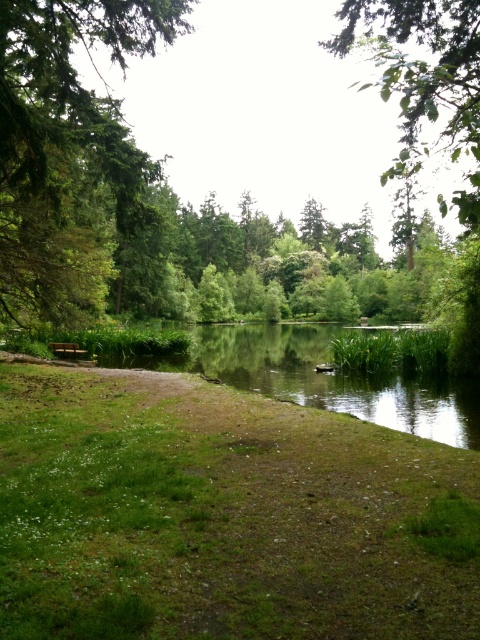
Image resolution: width=480 pixels, height=640 pixels. Identify the location of green leafy tree at upper right. (425, 77).

From the picture: Is green leafy tree at upper right positioned at the back of wooden bench at lower left?

No, it is in front of wooden bench at lower left.

Measure the distance between green leafy tree at upper right and camera.

The distance of green leafy tree at upper right from camera is 17.59 feet.

You are a GUI agent. You are given a task and a screenshot of the screen. Output one action in this format:
    pyautogui.click(x=<x>, y=<y>)
    Task: Click on the green leafy tree at upper right
    Image resolution: width=480 pixels, height=640 pixels.
    Given the screenshot: What is the action you would take?
    pyautogui.click(x=425, y=77)

Does point (48, 275) come in front of point (66, 355)?

Yes, it is.

Who is more forward, (4, 17) or (63, 349)?

Point (4, 17) is in front.

Does point (35, 236) come in front of point (71, 353)?

Yes.

Locate an element on the screen. Image resolution: width=480 pixels, height=640 pixels. green leafy tree at left is located at coordinates (69, 150).

Measure the distance from green leafy tree at left to green leafy tree at upper right.

green leafy tree at left is 17.43 meters away from green leafy tree at upper right.

Can you confirm if green leafy tree at left is smaller than green leafy tree at upper right?

Correct, green leafy tree at left occupies less space than green leafy tree at upper right.

Is point (48, 97) positioned behind point (408, 35)?

Yes, it is.

You are a GUI agent. You are given a task and a screenshot of the screen. Output one action in this format:
    pyautogui.click(x=<x>, y=<y>)
    Task: Click on the green leafy tree at left
    
    Given the screenshot: What is the action you would take?
    pyautogui.click(x=69, y=150)